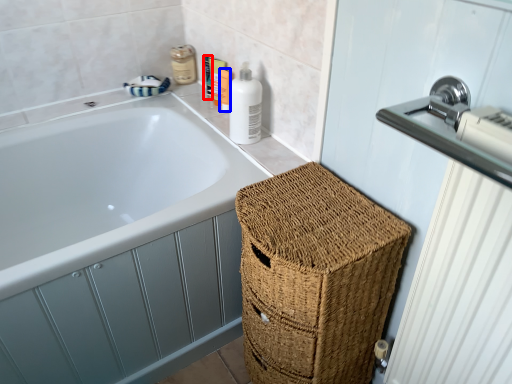
Question: Which object is further to the camera taking this photo, toiletry (highlighted by a red box) or toiletry (highlighted by a blue box)?

Choices:
 (A) toiletry
 (B) toiletry

Answer: (A)